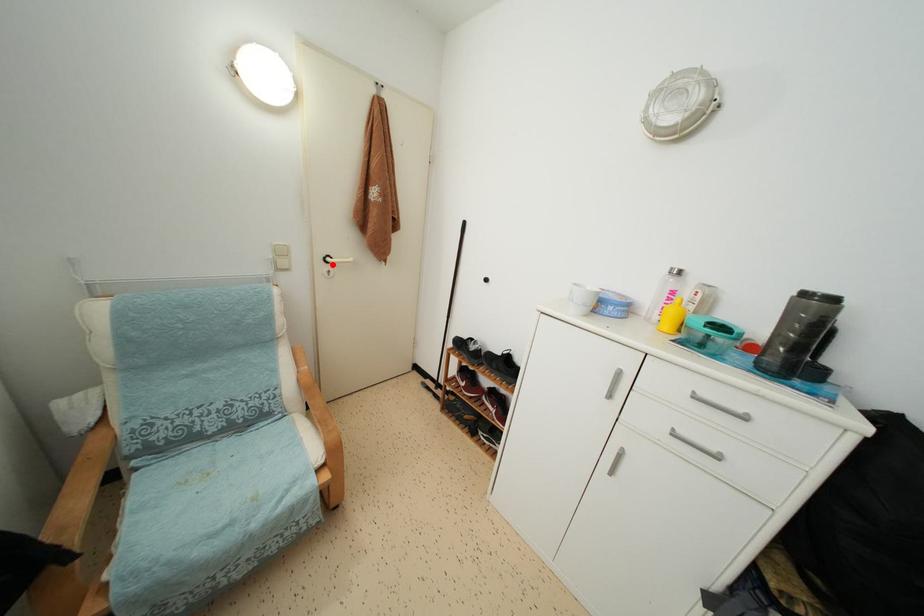
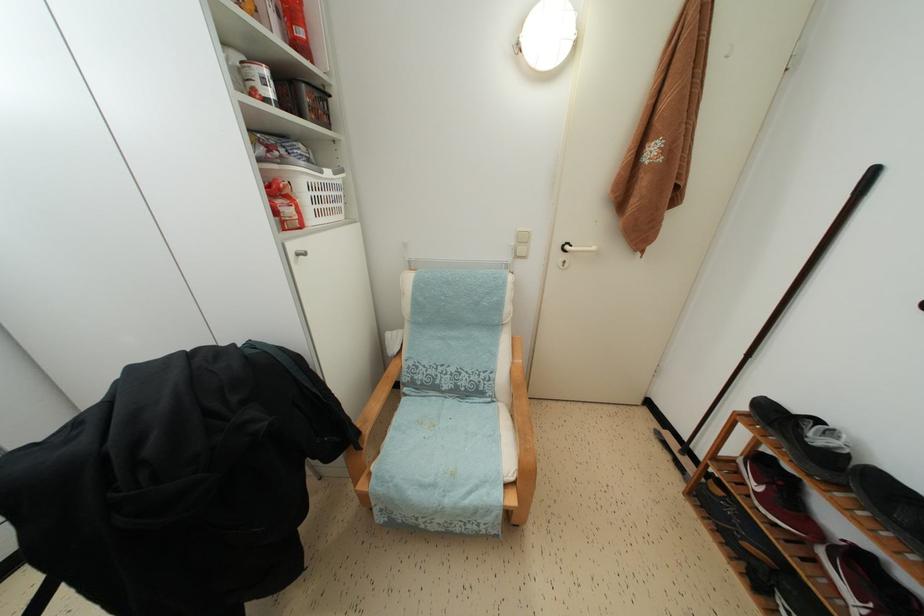
Find the pixel in the second image that matches the highlighted location in the first image.

(572, 253)